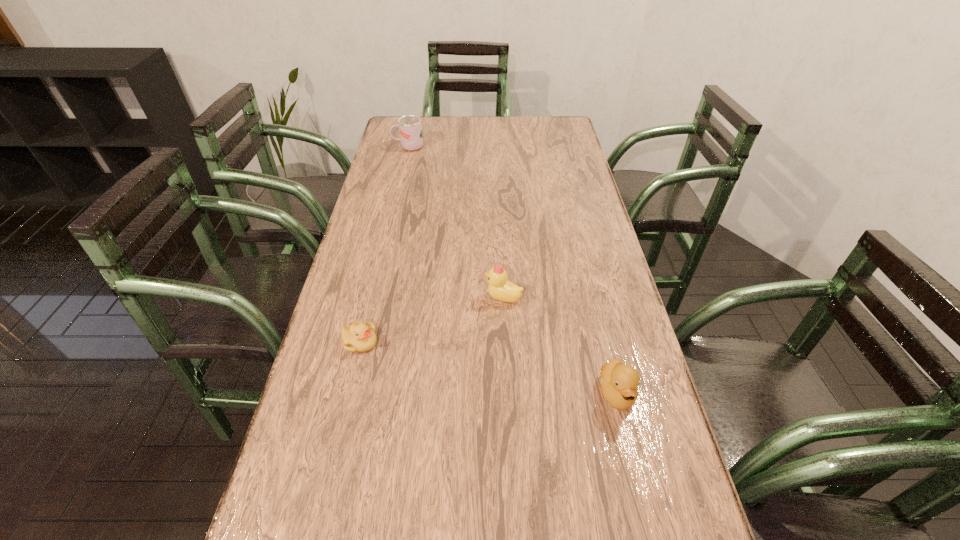
This screenshot has width=960, height=540. I want to click on free location located 0.160m on the front-facing side of the second object from right to left, so click(423, 298).

Find the location of a particular element. This screenshot has height=540, width=960. free region located facing forward on the rightmost object is located at coordinates (633, 461).

Image resolution: width=960 pixels, height=540 pixels. Identify the location of free space located 0.390m on the front-facing side of the third farthest object. (540, 342).

Where is `object present at the far edge`? This screenshot has height=540, width=960. object present at the far edge is located at coordinates (410, 127).

Locate an element on the screen. Image resolution: width=960 pixels, height=540 pixels. cup present at the left edge is located at coordinates (410, 127).

This screenshot has width=960, height=540. I want to click on duckling present at the left edge, so click(x=359, y=337).

The height and width of the screenshot is (540, 960). In order to click on object that is at the right edge in this screenshot , I will do `click(619, 382)`.

Identify the location of object present at the far left corner. (410, 127).

This screenshot has width=960, height=540. I want to click on free location at the far edge, so pyautogui.click(x=426, y=139).

Where is `free space at the left edge of the desktop`? The width and height of the screenshot is (960, 540). free space at the left edge of the desktop is located at coordinates (331, 393).